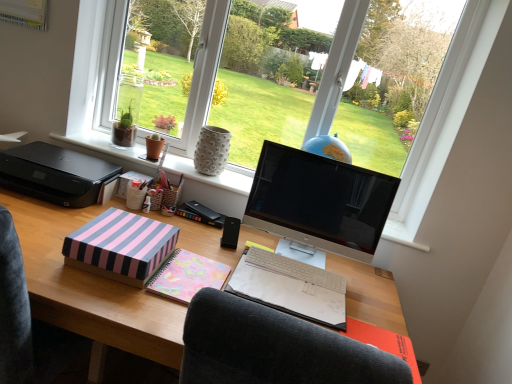
Image resolution: width=512 pixels, height=384 pixels. I want to click on free space above wooden desk at center (from a real-world perspective), so click(208, 256).